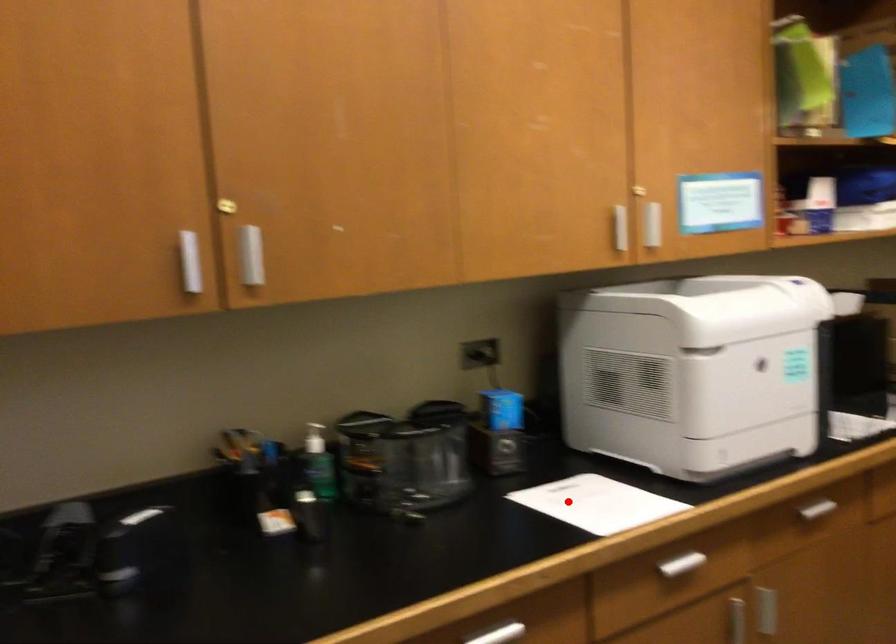
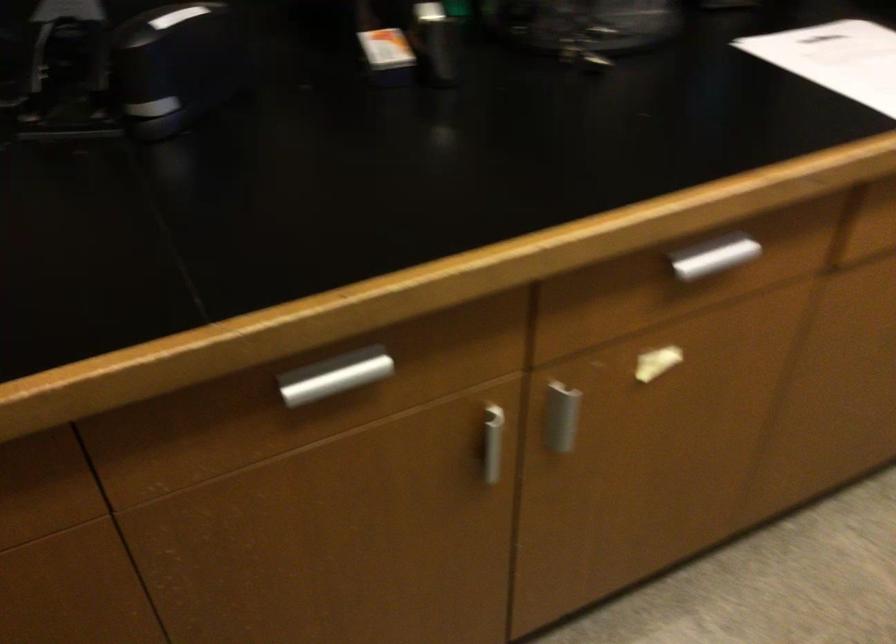
In the second image, find the point that corresponds to the highlighted location in the first image.

(836, 59)